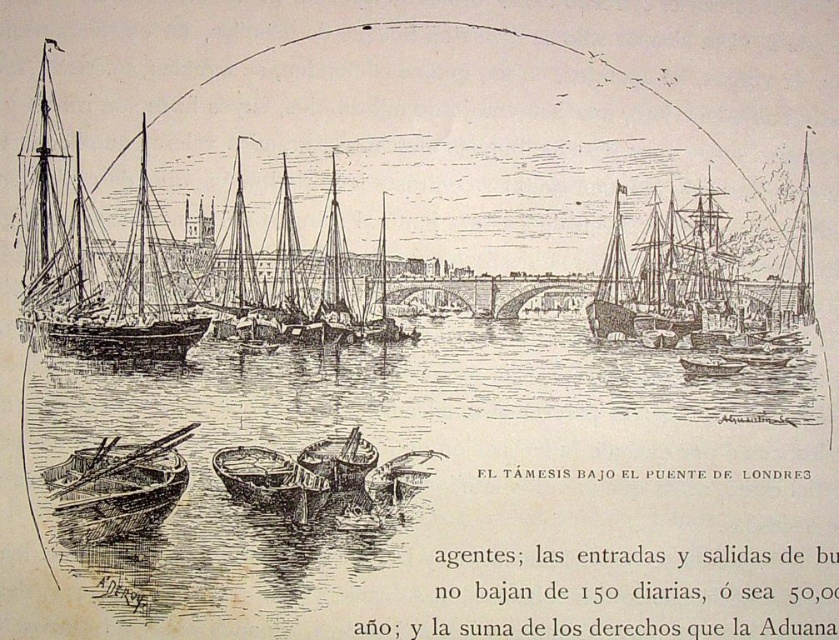
Describe the element at coordinates (456, 467) in the screenshot. The image size is (839, 640). I see `transparent water at center` at that location.

Can you confirm if transparent water at center is shorter than wooden boat at center?

No.

Is point (337, 532) closer to viewer compared to point (271, 512)?

That is False.

The height and width of the screenshot is (640, 839). I want to click on transparent water at center, so (x=456, y=467).

Does wooden boat at lower left appear on the right side of wooden boat at right?

In fact, wooden boat at lower left is to the left of wooden boat at right.

Is wooden boat at lower left taller than wooden boat at right?

Yes.

Where is `wooden boat at lower left`? The image size is (839, 640). wooden boat at lower left is located at coordinates (116, 486).

Can you confirm if transparent water at center is positioned below wooden boat at lower left?

No.

Is point (475, 403) more distant than point (162, 492)?

Yes, point (475, 403) is farther from viewer.

Find the location of a particular element. Image resolution: width=839 pixels, height=640 pixels. transparent water at center is located at coordinates (456, 467).